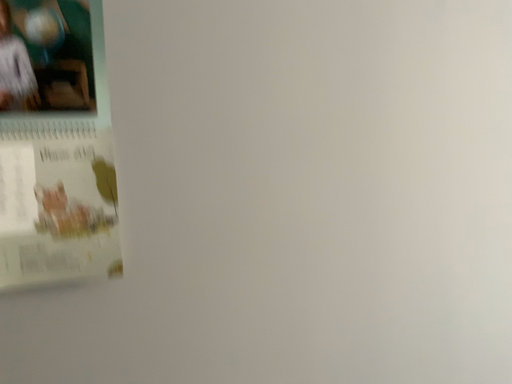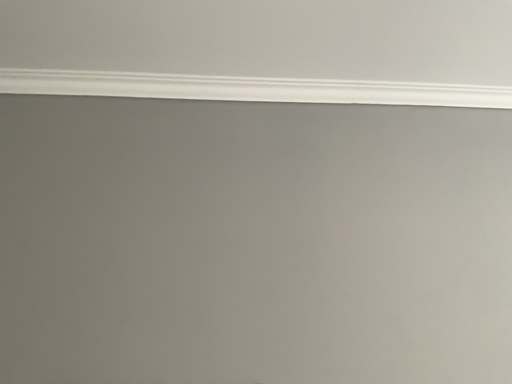
Question: How did the camera likely rotate when shooting the video?

Choices:
 (A) rotated downward
 (B) rotated upward

Answer: (B)